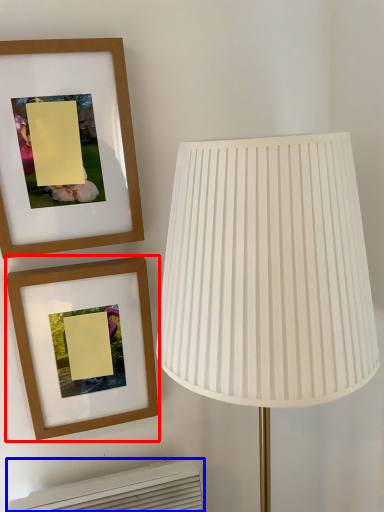
Question: Which point is further to the camera, picture frame (highlighted by a red box) or air conditioner (highlighted by a blue box)?

Choices:
 (A) picture frame
 (B) air conditioner

Answer: (B)